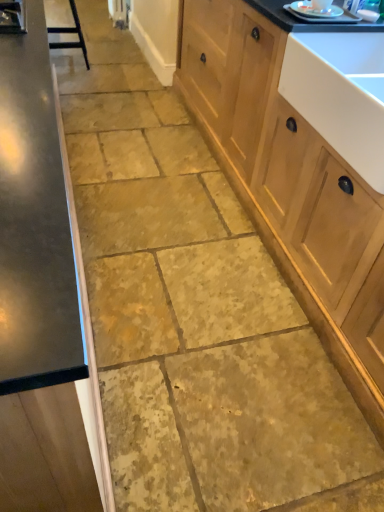
What is the approximate height of black metal bar stool at upper left?

21.46 inches.

What do you see at coordinates (340, 94) in the screenshot?
I see `white glossy sink at upper right` at bounding box center [340, 94].

What do you see at coordinates (43, 298) in the screenshot? The width and height of the screenshot is (384, 512). I see `satin wood cabinet at left, the 1th cabinetry in the left-to-right sequence` at bounding box center [43, 298].

Describe the element at coordinates (303, 165) in the screenshot. The height and width of the screenshot is (512, 384). I see `wooden cabinet at right, which appears as the second cabinetry when viewed from the left` at that location.

Image resolution: width=384 pixels, height=512 pixels. I want to click on metallic silver plate at upper right, so click(x=314, y=11).

Is white glossy sink at upper right wider or thinner than black metal bar stool at upper left?

Clearly, white glossy sink at upper right has more width compared to black metal bar stool at upper left.

From the image's perspective, is white glossy sink at upper right under black metal bar stool at upper left?

Yes.

From a real-world perspective, is white glossy sink at upper right above or below black metal bar stool at upper left?

white glossy sink at upper right is above black metal bar stool at upper left.

Does white glossy sink at upper right come in front of black metal bar stool at upper left?

Yes, white glossy sink at upper right is closer to the camera.

Considering the sizes of objects wooden cabinet at right, placed as the first cabinetry when sorted from right to left, and white glossy sink at upper right in the image provided, who is wider, wooden cabinet at right, placed as the first cabinetry when sorted from right to left, or white glossy sink at upper right?

wooden cabinet at right, placed as the first cabinetry when sorted from right to left, is wider.

Is wooden cabinet at right, which appears as the second cabinetry when viewed from the left, positioned with its back to white glossy sink at upper right?

Absolutely, wooden cabinet at right, which appears as the second cabinetry when viewed from the left, is directed away from white glossy sink at upper right.

Which of these two, wooden cabinet at right, placed as the first cabinetry when sorted from right to left, or white glossy sink at upper right, is smaller?

white glossy sink at upper right.

Which is correct: satin wood cabinet at left, which ranks as the 2th cabinetry in right-to-left order, is inside metallic silver plate at upper right, or outside of it?

The correct answer is: outside.

Identify the location of the 1st cabinetry below the metallic silver plate at upper right (from a real-world perspective). The width and height of the screenshot is (384, 512). (43, 298).

From the image's perspective, is satin wood cabinet at left, which ranks as the 2th cabinetry in right-to-left order, beneath metallic silver plate at upper right?

Indeed, from the image's perspective, satin wood cabinet at left, which ranks as the 2th cabinetry in right-to-left order, is shown beneath metallic silver plate at upper right.

Looking at their sizes, would you say satin wood cabinet at left, which ranks as the 2th cabinetry in right-to-left order, is wider or thinner than metallic silver plate at upper right?

Considering their sizes, satin wood cabinet at left, which ranks as the 2th cabinetry in right-to-left order, looks broader than metallic silver plate at upper right.

From the picture: Is metallic silver plate at upper right at the back of black metal bar stool at upper left?

No.

From a real-world perspective, which is physically above, black metal bar stool at upper left or metallic silver plate at upper right?

metallic silver plate at upper right.

Does black metal bar stool at upper left contain metallic silver plate at upper right?

No, metallic silver plate at upper right is not a part of black metal bar stool at upper left.

This screenshot has width=384, height=512. I want to click on appliance in front of the black metal bar stool at upper left, so [x=314, y=11].

Is metallic silver plate at upper right to the left of white glossy sink at upper right from the viewer's perspective?

Correct, you'll find metallic silver plate at upper right to the left of white glossy sink at upper right.

Can we say metallic silver plate at upper right lies outside white glossy sink at upper right?

Absolutely, metallic silver plate at upper right is external to white glossy sink at upper right.

Is metallic silver plate at upper right further to the viewer compared to white glossy sink at upper right?

Yes, the depth of metallic silver plate at upper right is greater than that of white glossy sink at upper right.

Between point (353, 125) and point (297, 256), which one is positioned behind?

The point (297, 256) is farther.

From a real-world perspective, is white glossy sink at upper right physically below wooden cabinet at right, placed as the first cabinetry when sorted from right to left?

Incorrect, from a real-world perspective, white glossy sink at upper right is higher than wooden cabinet at right, placed as the first cabinetry when sorted from right to left.

Considering the positions of objects white glossy sink at upper right and wooden cabinet at right, placed as the first cabinetry when sorted from right to left, in the image provided, who is more to the right, white glossy sink at upper right or wooden cabinet at right, placed as the first cabinetry when sorted from right to left,?

white glossy sink at upper right is more to the right.

In terms of size, does white glossy sink at upper right appear bigger or smaller than wooden cabinet at right, placed as the first cabinetry when sorted from right to left?

Clearly, white glossy sink at upper right is smaller in size than wooden cabinet at right, placed as the first cabinetry when sorted from right to left.

Which object is closer to the camera taking this photo, satin wood cabinet at left, which ranks as the 2th cabinetry in right-to-left order, or white glossy sink at upper right?

satin wood cabinet at left, which ranks as the 2th cabinetry in right-to-left order, is more forward.

Is white glossy sink at upper right located within satin wood cabinet at left, the 1th cabinetry in the left-to-right sequence?

Actually, white glossy sink at upper right is outside satin wood cabinet at left, the 1th cabinetry in the left-to-right sequence.

Looking at their sizes, would you say satin wood cabinet at left, which ranks as the 2th cabinetry in right-to-left order, is wider or thinner than white glossy sink at upper right?

Considering their sizes, satin wood cabinet at left, which ranks as the 2th cabinetry in right-to-left order, looks slimmer than white glossy sink at upper right.

Measure the distance between satin wood cabinet at left, which ranks as the 2th cabinetry in right-to-left order, and white glossy sink at upper right.

The distance of satin wood cabinet at left, which ranks as the 2th cabinetry in right-to-left order, from white glossy sink at upper right is 39.20 inches.

Where is `bar stool that is on the left side of white glossy sink at upper right`? This screenshot has width=384, height=512. bar stool that is on the left side of white glossy sink at upper right is located at coordinates (70, 33).

Locate an element on the screen. sink behind the wooden cabinet at right, placed as the first cabinetry when sorted from right to left is located at coordinates (340, 94).

From the image, which object appears to be farther from black metal bar stool at upper left, wooden cabinet at right, placed as the first cabinetry when sorted from right to left, or metallic silver plate at upper right?

metallic silver plate at upper right lies further to black metal bar stool at upper left than the other object.

Considering their positions, is white glossy sink at upper right positioned further to satin wood cabinet at left, the 1th cabinetry in the left-to-right sequence, than black metal bar stool at upper left?

The object further to satin wood cabinet at left, the 1th cabinetry in the left-to-right sequence, is black metal bar stool at upper left.

From the image, which object appears to be farther from white glossy sink at upper right, wooden cabinet at right, placed as the first cabinetry when sorted from right to left, or black metal bar stool at upper left?

black metal bar stool at upper left.

When comparing their distances from white glossy sink at upper right, does metallic silver plate at upper right or black metal bar stool at upper left seem further?

black metal bar stool at upper left lies further to white glossy sink at upper right than the other object.

In the scene shown: Estimate the real-world distances between objects in this image. Which object is further from black metal bar stool at upper left, metallic silver plate at upper right or white glossy sink at upper right?

Based on the image, white glossy sink at upper right appears to be further to black metal bar stool at upper left.

When comparing their distances from white glossy sink at upper right, does satin wood cabinet at left, the 1th cabinetry in the left-to-right sequence, or black metal bar stool at upper left seem further?

black metal bar stool at upper left.

Based on their spatial positions, is black metal bar stool at upper left or white glossy sink at upper right further from satin wood cabinet at left, the 1th cabinetry in the left-to-right sequence?

black metal bar stool at upper left lies further to satin wood cabinet at left, the 1th cabinetry in the left-to-right sequence, than the other object.

From the image, which object appears to be farther from black metal bar stool at upper left, white glossy sink at upper right or satin wood cabinet at left, the 1th cabinetry in the left-to-right sequence?

satin wood cabinet at left, the 1th cabinetry in the left-to-right sequence.

Where is `cabinetry between satin wood cabinet at left, which ranks as the 2th cabinetry in right-to-left order, and black metal bar stool at upper left, along the z-axis`? cabinetry between satin wood cabinet at left, which ranks as the 2th cabinetry in right-to-left order, and black metal bar stool at upper left, along the z-axis is located at coordinates (303, 165).

Locate an element on the screen. appliance between satin wood cabinet at left, the 1th cabinetry in the left-to-right sequence, and white glossy sink at upper right is located at coordinates (314, 11).

Locate an element on the screen. The image size is (384, 512). sink between satin wood cabinet at left, which ranks as the 2th cabinetry in right-to-left order, and black metal bar stool at upper left in the front-back direction is located at coordinates (340, 94).

Where is `sink between wooden cabinet at right, which appears as the second cabinetry when viewed from the left, and metallic silver plate at upper right from front to back`? sink between wooden cabinet at right, which appears as the second cabinetry when viewed from the left, and metallic silver plate at upper right from front to back is located at coordinates (340, 94).